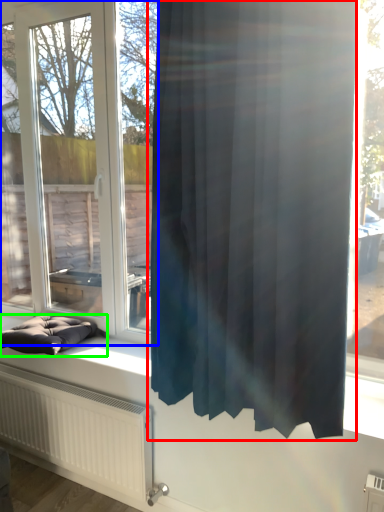
Question: Which object is positioned farthest from curtain (highlighted by a red box)? Select from window (highlighted by a blue box) and furniture (highlighted by a green box).

Choices:
 (A) window
 (B) furniture

Answer: (A)